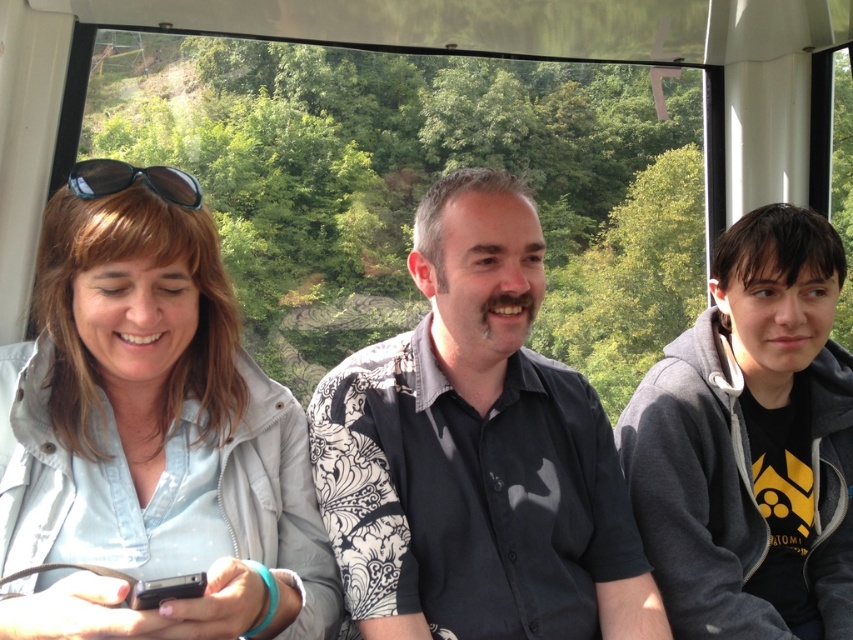
Can you confirm if light blue denim jacket at left is positioned to the left of dark gray shirt at center?

Yes, light blue denim jacket at left is to the left of dark gray shirt at center.

Which is in front, point (245, 493) or point (444, 410)?

Point (245, 493) is more forward.

Where is `light blue denim jacket at left`? This screenshot has height=640, width=853. light blue denim jacket at left is located at coordinates (149, 442).

This screenshot has width=853, height=640. I want to click on light blue denim jacket at left, so click(x=149, y=442).

Does point (357, 470) come behind point (686, 378)?

No.

Is point (485, 468) closer to viewer compared to point (795, 532)?

Yes, point (485, 468) is closer to viewer.

Is point (450, 497) positioned before point (810, 556)?

Yes, it is.

Identify the location of dark gray shirt at center. This screenshot has width=853, height=640. (476, 452).

Is light blue denim jacket at left bigger than shiny black sunglasses at left?

Yes.

Does point (302, 436) come farther from viewer compared to point (177, 180)?

Yes, it is behind point (177, 180).

You are a GUI agent. You are given a task and a screenshot of the screen. Output one action in this format:
    pyautogui.click(x=<x>, y=<y>)
    Task: Click on the light blue denim jacket at left
    
    Given the screenshot: What is the action you would take?
    pos(149,442)